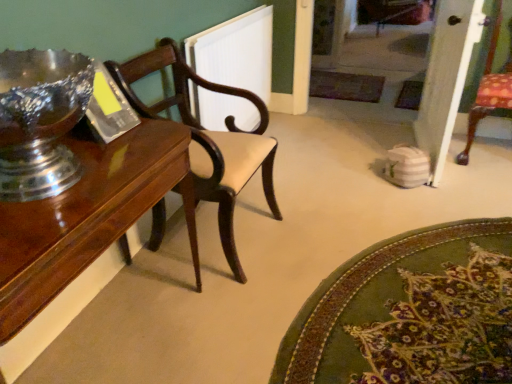
Locate an element on the screen. vacant space underneath mahogany wood chair at left (from a real-world perspective) is located at coordinates (208, 244).